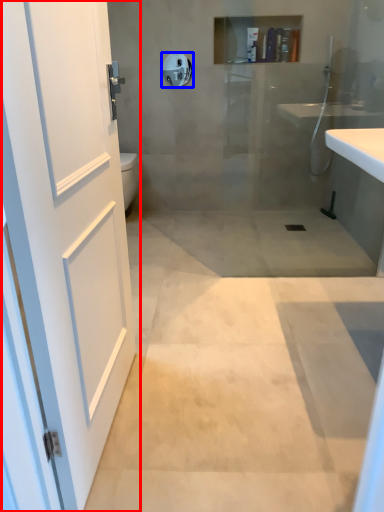
Question: Which object is further to the camera taking this photo, door (highlighted by a red box) or towel bar (highlighted by a blue box)?

Choices:
 (A) door
 (B) towel bar

Answer: (B)